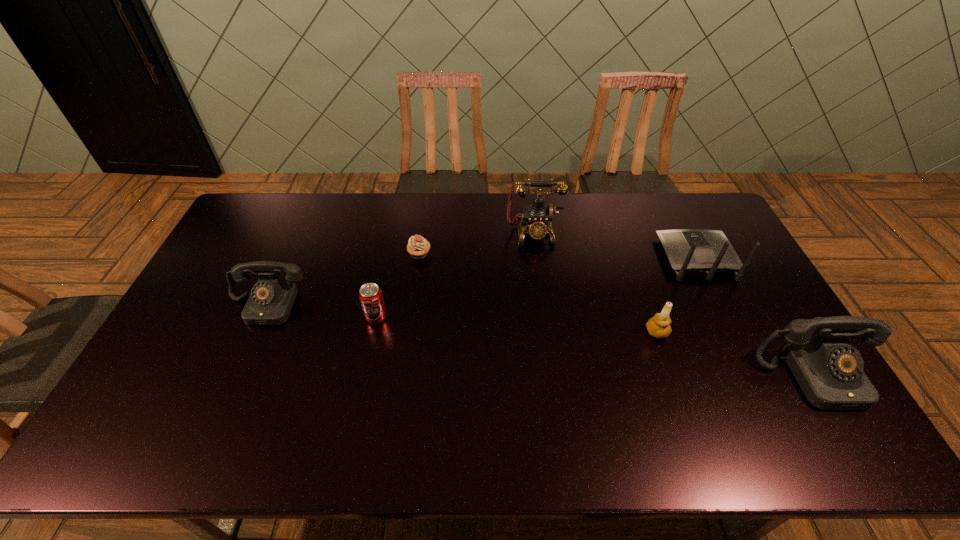
Locate an element on the screen. This screenshot has width=960, height=540. the leftmost telephone is located at coordinates (271, 299).

Locate an element on the screen. Image resolution: width=960 pixels, height=540 pixels. the leftmost object is located at coordinates (271, 299).

The image size is (960, 540). I want to click on the rightmost telephone, so click(x=829, y=370).

What are the coordinates of `the nearest telephone` in the screenshot? It's located at (829, 370).

Where is `soda`? This screenshot has width=960, height=540. soda is located at coordinates (370, 295).

You are a GUI agent. You are given a task and a screenshot of the screen. Output one action in this format:
    pyautogui.click(x=<x>, y=<y>)
    Task: Click on the router
    This screenshot has width=960, height=540.
    Given the screenshot: What is the action you would take?
    pyautogui.click(x=692, y=251)

Find the location of `cupcake`. cupcake is located at coordinates (418, 247).

Identify the location of the fifth object from right to left. (418, 247).

The height and width of the screenshot is (540, 960). Identify the location of the second telephone from right to left. (538, 217).

Where is `the farthest telephone`? The width and height of the screenshot is (960, 540). the farthest telephone is located at coordinates (538, 217).